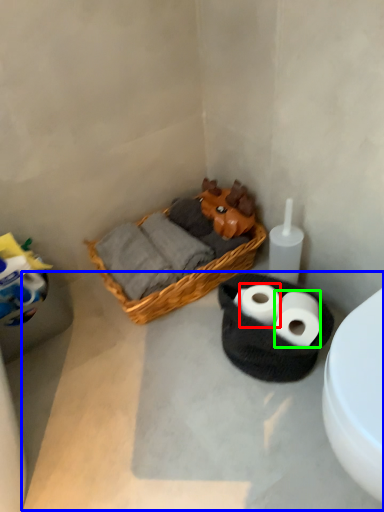
Question: Estimate the real-world distances between objects in this image. Which object is closer to toilet paper (highlighted by a red box), concrete (highlighted by a blue box) or toilet paper (highlighted by a green box)?

Choices:
 (A) concrete
 (B) toilet paper

Answer: (B)